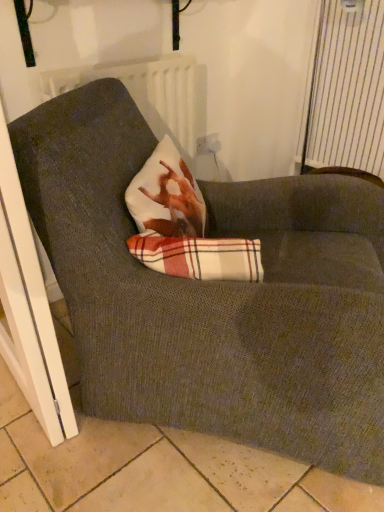
Question: Is white plastic screen door at lower left to the left or to the right of white striped curtain at upper right in the image?

Choices:
 (A) right
 (B) left

Answer: (B)

Question: Considering the positions of white plastic screen door at lower left and white striped curtain at upper right in the image, is white plastic screen door at lower left bigger or smaller than white striped curtain at upper right?

Choices:
 (A) small
 (B) big

Answer: (B)

Question: Which object is the farthest from the white plastic electric outlet at upper center?

Choices:
 (A) plaid fabric at center
 (B) white plastic screen door at lower left
 (C) white striped curtain at upper right

Answer: (B)

Question: Estimate the real-world distances between objects in this image. Which object is farther from the white striped curtain at upper right?

Choices:
 (A) white plastic screen door at lower left
 (B) plaid fabric at center
 (C) white plastic electric outlet at upper center

Answer: (A)